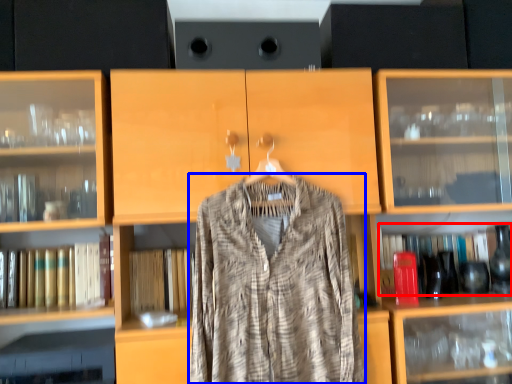
Question: Which of the following is the closest to the observer, book (highlighted by a red box) or fancy dress (highlighted by a blue box)?

Choices:
 (A) book
 (B) fancy dress

Answer: (B)